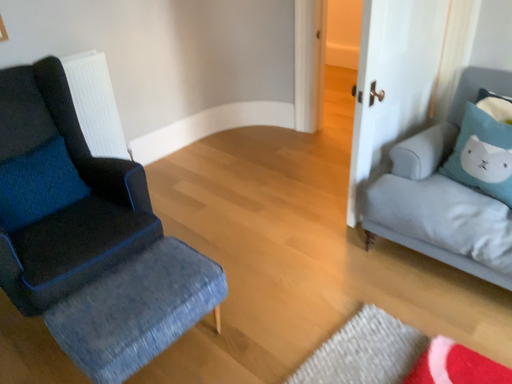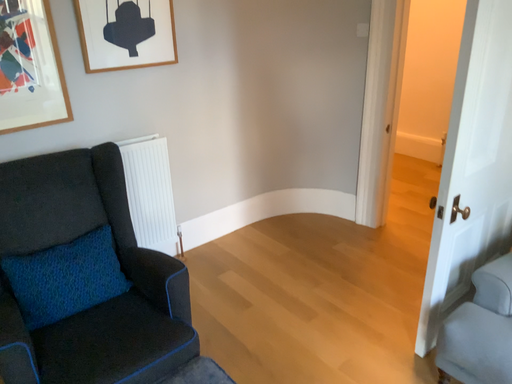
Question: Which way did the camera rotate in the video?

Choices:
 (A) rotated right
 (B) rotated left

Answer: (B)